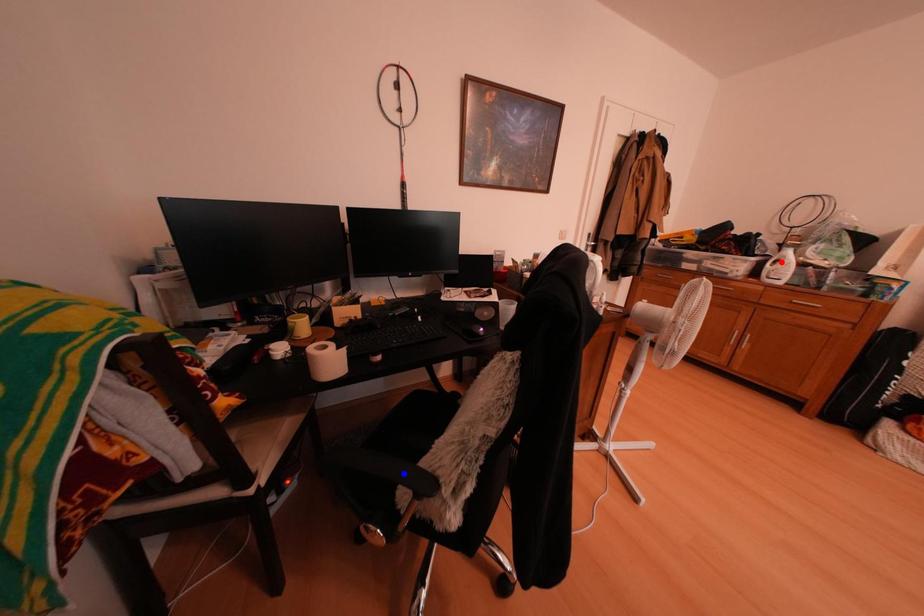
Question: Two points are marked on the image. Which point is closer to the camera?

Choices:
 (A) Blue point is closer.
 (B) Red point is closer.

Answer: (A)